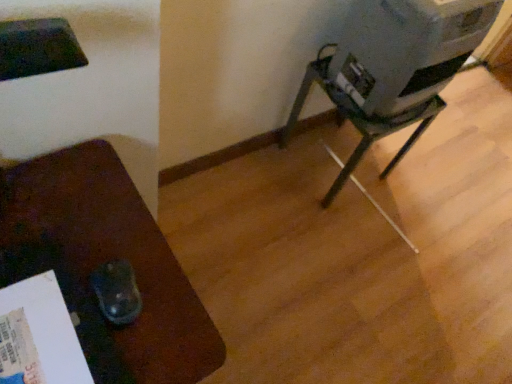
Question: From their relative heights in the image, would you say metallic gray water cooler at right is taller or shorter than metallic gray projector at center-right, which ranks as the first furniture in back-to-front order?

Choices:
 (A) short
 (B) tall

Answer: (A)

Question: In the image, is metallic gray water cooler at right positioned in front of or behind metallic gray projector at center-right, which ranks as the first furniture in back-to-front order?

Choices:
 (A) behind
 (B) front

Answer: (B)

Question: Considering the real-world distances, which object is closest to the metallic gray projector at center-right, which ranks as the first furniture in back-to-front order?

Choices:
 (A) matte brown mouse pad at left, which is the first furniture from front to back
 (B) metallic gray water cooler at right

Answer: (B)

Question: Which object is the farthest from the matte brown mouse pad at left, which is the first furniture from front to back?

Choices:
 (A) metallic gray water cooler at right
 (B) metallic gray projector at center-right, arranged as the 1th furniture when viewed from the right

Answer: (B)